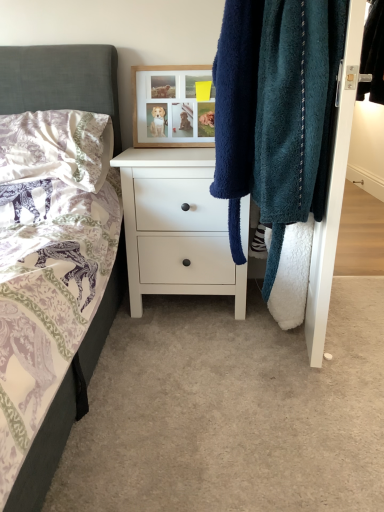
Locate an element on the screen. This screenshot has width=384, height=512. vacant region below black leather jacket at upper right (from a real-world perspective) is located at coordinates (360, 209).